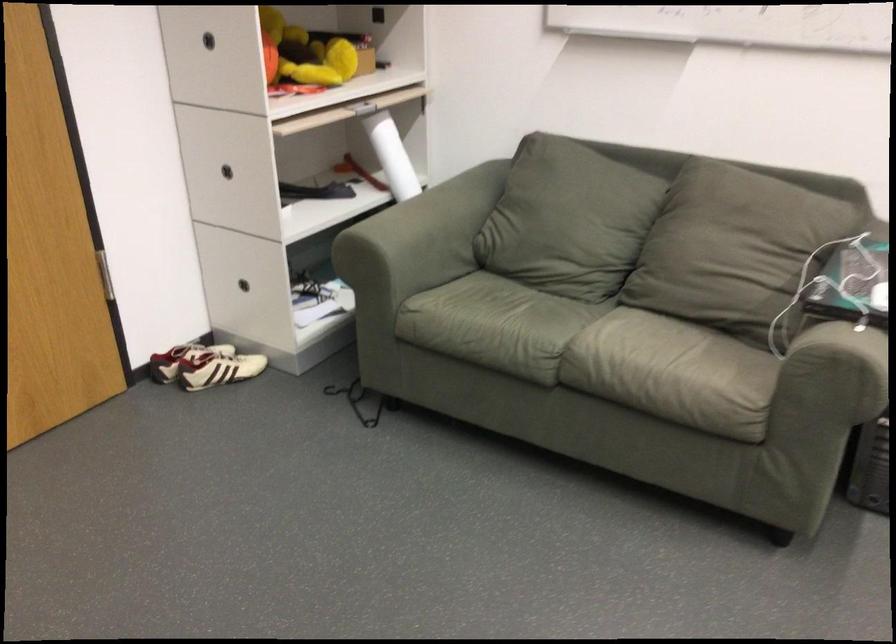
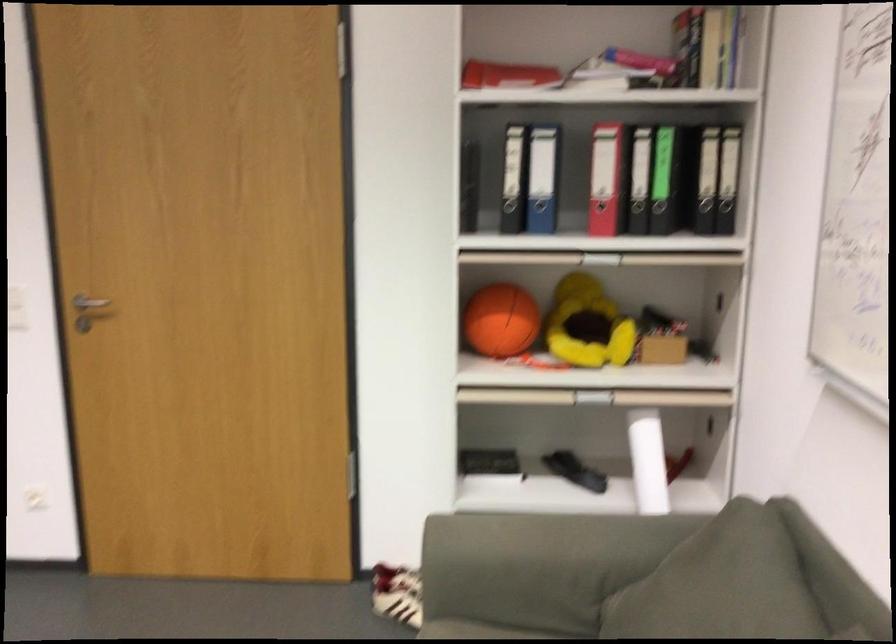
Question: I am providing you with two images of the same scene from different viewpoints. After the viewpoint changes to image2, which objects are now occluded?

Choices:
 (A) black drawer handle
 (B) brown padded armrest
 (C) white rolled paper
 (D) red binder hole

Answer: (A)